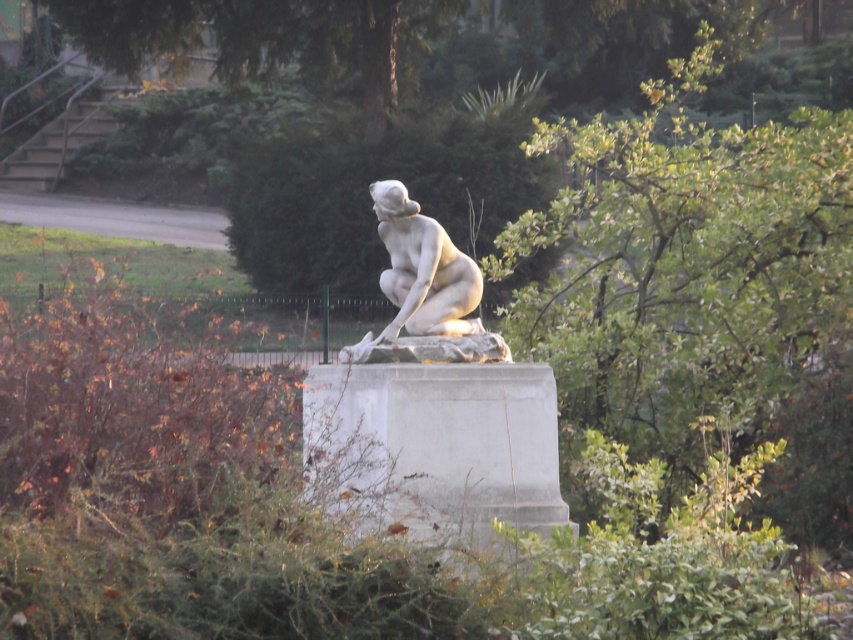
Question: Can you confirm if green leafy tree at upper center is bigger than white marble statue at center?

Choices:
 (A) no
 (B) yes

Answer: (B)

Question: Is green leafy tree at upper center wider than white marble statue at center?

Choices:
 (A) no
 (B) yes

Answer: (B)

Question: Among these objects, which one is farthest from the camera?

Choices:
 (A) white marble statue at center
 (B) green leafy tree at upper center

Answer: (B)

Question: Does green leafy tree at upper center have a lesser width compared to white marble statue at center?

Choices:
 (A) yes
 (B) no

Answer: (B)

Question: Which of the following is the farthest from the observer?

Choices:
 (A) green leafy tree at upper center
 (B) white marble statue at center

Answer: (A)

Question: Which point is closer to the camera taking this photo?

Choices:
 (A) (392, 180)
 (B) (709, 230)

Answer: (A)